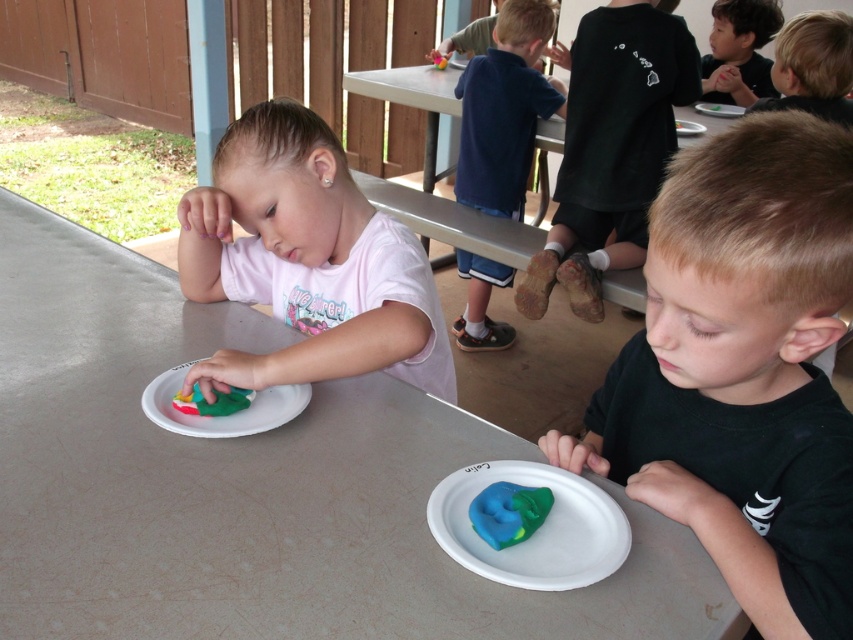
Based on the scene description, where is the smooth black shirt at upper right located in the image?

The smooth black shirt at upper right is located at point coordinates of (740, 51).